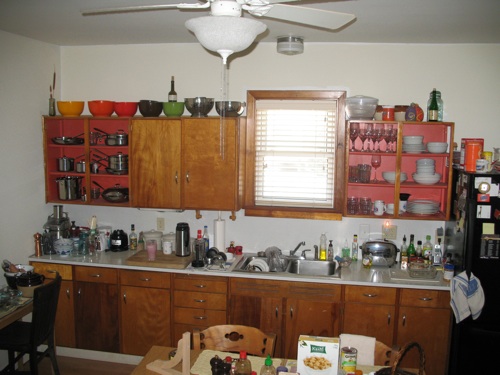
Where is `fan`? fan is located at coordinates (229, 36), (211, 32), (293, 19).